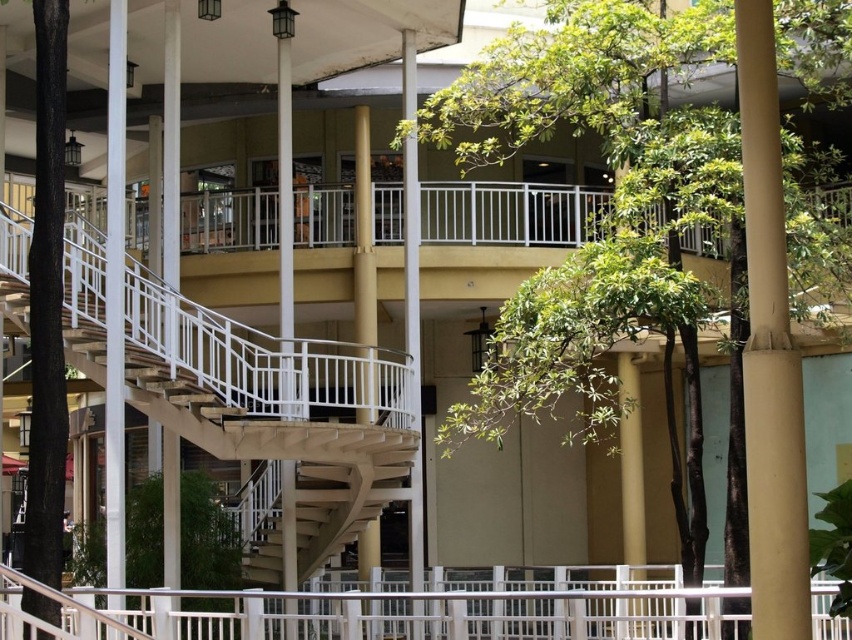
Question: Which point appears farthest from the camera in this image?

Choices:
 (A) (249, 634)
 (B) (676, 44)
 (C) (766, 397)

Answer: (B)

Question: Does white metal railing at center come behind tan smooth pole at right?

Choices:
 (A) yes
 (B) no

Answer: (A)

Question: Does green leafy tree at center have a larger size compared to tan smooth pole at right?

Choices:
 (A) no
 (B) yes

Answer: (B)

Question: Can you confirm if green leafy tree at center is smaller than tan smooth pole at right?

Choices:
 (A) yes
 (B) no

Answer: (B)

Question: Which point is farther to the camera?

Choices:
 (A) (798, 600)
 (B) (504, 604)
 (C) (622, 4)

Answer: (B)

Question: Which point appears closest to the camera in this image?

Choices:
 (A) (744, 109)
 (B) (773, 228)

Answer: (B)